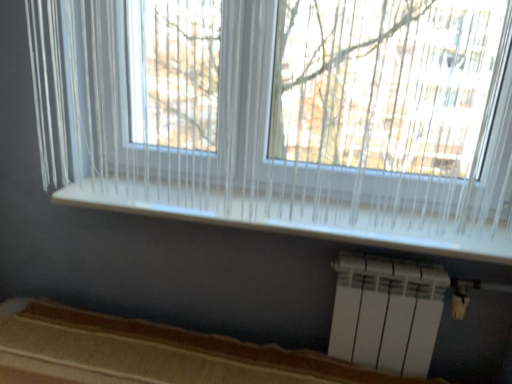
The height and width of the screenshot is (384, 512). Identify the location of free location above brown fabric bed frame at lower center (from a real-world perspective). (92, 347).